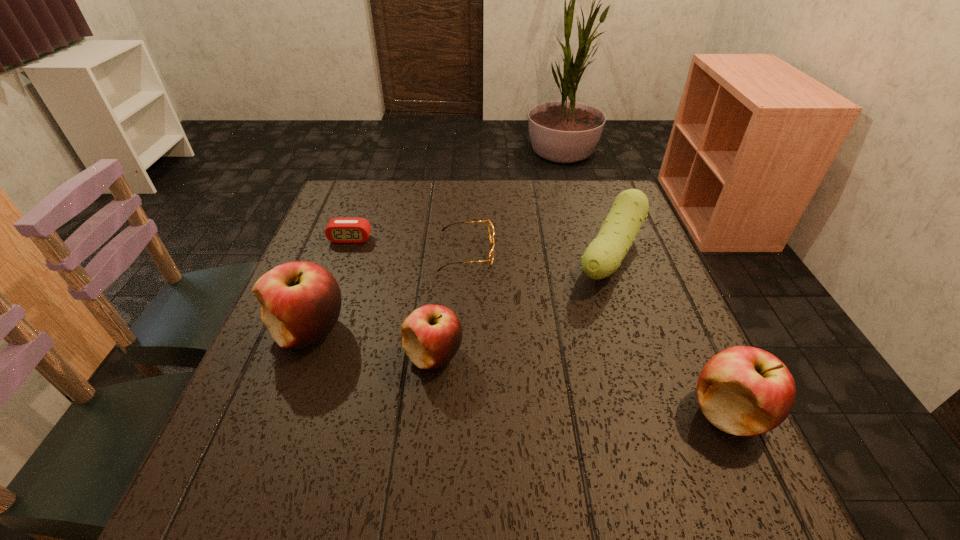
The image size is (960, 540). What are the coordinates of `object positioned at the near right corner` in the screenshot? It's located at (744, 391).

The image size is (960, 540). In order to click on free location at the far edge of the desktop in this screenshot , I will do `click(472, 196)`.

Locate an element on the screen. The width and height of the screenshot is (960, 540). free space at the left edge of the desktop is located at coordinates (258, 370).

I want to click on vacant region at the right edge, so click(630, 254).

Find the location of `free space at the far left corner of the desktop`. free space at the far left corner of the desktop is located at coordinates (347, 210).

The width and height of the screenshot is (960, 540). In the image, there is a desktop. Find the location of `vacant space at the near left corner`. vacant space at the near left corner is located at coordinates (256, 448).

In the image, there is a desktop. Where is `vacant space at the far right corner`? The height and width of the screenshot is (540, 960). vacant space at the far right corner is located at coordinates (585, 210).

Find the location of a particular element. free spot between the cucumber and the rightmost apple is located at coordinates (670, 334).

In order to click on free space between the leftmost apple and the spectacles in this screenshot , I will do `click(388, 292)`.

Identify the location of free space that is in between the leftmost apple and the spectacles. The height and width of the screenshot is (540, 960). (388, 292).